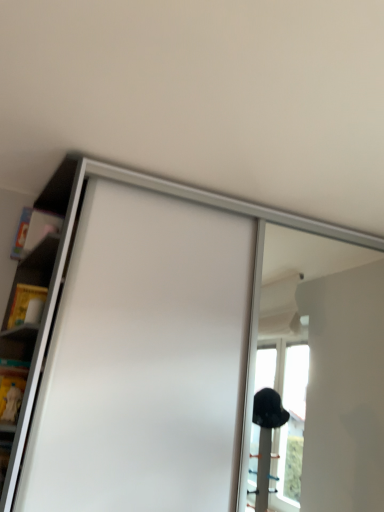
This screenshot has width=384, height=512. Find the location of `white glossy shelf at upper left`. white glossy shelf at upper left is located at coordinates (39, 322).

This screenshot has height=512, width=384. What do you see at coordinates (39, 322) in the screenshot?
I see `white glossy shelf at upper left` at bounding box center [39, 322].

Looking at this image, in order to face white glossy shelf at upper left, should I rotate leftwards or rightwards?

Rotate your view left by about 22.064°.

In the scene shown: In order to face white matte sliding door at center, should I rotate leftwards or rightwards?

To align with it, rotate right about 4.540°.

This screenshot has width=384, height=512. Identify the location of white matte sliding door at center. (144, 360).

What do you see at coordinates (144, 360) in the screenshot? The height and width of the screenshot is (512, 384). I see `white matte sliding door at center` at bounding box center [144, 360].

The width and height of the screenshot is (384, 512). I want to click on white glossy shelf at upper left, so click(x=39, y=322).

Between white matte sliding door at center and white glossy shelf at upper left, which one appears on the left side from the viewer's perspective?

Positioned to the left is white glossy shelf at upper left.

Which object is further away from the camera taking this photo, white matte sliding door at center or white glossy shelf at upper left?

white matte sliding door at center is more distant.

Which point is more distant from viewer, (201,345) or (9,348)?

The point (9,348) is more distant.

From the image's perspective, relative to white glossy shelf at upper left, is white matte sliding door at center above or below?

white matte sliding door at center is situated lower than white glossy shelf at upper left in the image.

From a real-world perspective, is white matte sliding door at center positioned under white glossy shelf at upper left based on gravity?

Yes.

In the scene shown: Considering the sizes of white matte sliding door at center and white glossy shelf at upper left in the image, is white matte sliding door at center wider or thinner than white glossy shelf at upper left?

In the image, white matte sliding door at center appears to be wider than white glossy shelf at upper left.

Who is taller, white matte sliding door at center or white glossy shelf at upper left?

white matte sliding door at center.

Looking at the image, does white matte sliding door at center seem bigger or smaller compared to white glossy shelf at upper left?

Considering their sizes, white matte sliding door at center takes up more space than white glossy shelf at upper left.

Is white matte sliding door at center located outside white glossy shelf at upper left?

Absolutely, white matte sliding door at center is external to white glossy shelf at upper left.

Does white matte sliding door at center touch white glossy shelf at upper left?

No.

In the scene shown: Is white matte sliding door at center aimed at white glossy shelf at upper left?

No, white matte sliding door at center is not oriented towards white glossy shelf at upper left.

How many degrees apart are the facing directions of white matte sliding door at center and white glossy shelf at upper left?

They differ by 86.5 degrees in their facing directions.

Measure the distance from white matte sliding door at center to white glossy shelf at upper left.

white matte sliding door at center is 14.36 inches from white glossy shelf at upper left.

Locate an element on the screen. Image resolution: width=384 pixels, height=512 pixels. shelf on the left of white matte sliding door at center is located at coordinates (39, 322).

Which object is positioned more to the left, white glossy shelf at upper left or white matte sliding door at center?

white glossy shelf at upper left is more to the left.

Which object is further away from the camera taking this photo, white glossy shelf at upper left or white matte sliding door at center?

white matte sliding door at center is more distant.

Does point (51, 239) lie in front of point (94, 365)?

No.

From the image's perspective, is white glossy shelf at upper left on top of white matte sliding door at center?

Correct, white glossy shelf at upper left appears higher than white matte sliding door at center in the image.

From a real-world perspective, who is located higher, white glossy shelf at upper left or white matte sliding door at center?

In real-world perspective, white glossy shelf at upper left is above.

Consider the image. Considering the sizes of objects white glossy shelf at upper left and white matte sliding door at center in the image provided, who is thinner, white glossy shelf at upper left or white matte sliding door at center?

white glossy shelf at upper left is thinner.

Based on the photo, in terms of height, does white glossy shelf at upper left look taller or shorter compared to white matte sliding door at center?

Clearly, white glossy shelf at upper left is shorter compared to white matte sliding door at center.

Is white glossy shelf at upper left bigger or smaller than white matte sliding door at center?

white glossy shelf at upper left is smaller than white matte sliding door at center.

Would you say white glossy shelf at upper left is inside or outside white matte sliding door at center?

white glossy shelf at upper left cannot be found inside white matte sliding door at center.

In the scene shown: Are white glossy shelf at upper left and white matte sliding door at center located far from each other?

No, white glossy shelf at upper left is not far away from white matte sliding door at center.

Is white glossy shelf at upper left oriented towards white matte sliding door at center?

Yes.

What's the angular difference between white glossy shelf at upper left and white matte sliding door at center's facing directions?

86.5 degrees.

Measure the distance between white glossy shelf at upper left and white matte sliding door at center.

The distance of white glossy shelf at upper left from white matte sliding door at center is 14.36 inches.

You are a GUI agent. You are given a task and a screenshot of the screen. Output one action in this format:
    pyautogui.click(x=<x>, y=<y>)
    Task: Click on the screen door that appears behind the white glossy shelf at upper left
    The height and width of the screenshot is (512, 384).
    Given the screenshot: What is the action you would take?
    pyautogui.click(x=144, y=360)

Locate an element on the screen. The image size is (384, 512). screen door below the white glossy shelf at upper left (from the image's perspective) is located at coordinates (144, 360).

Locate an element on the screen. The height and width of the screenshot is (512, 384). screen door below the white glossy shelf at upper left (from a real-world perspective) is located at coordinates (144, 360).